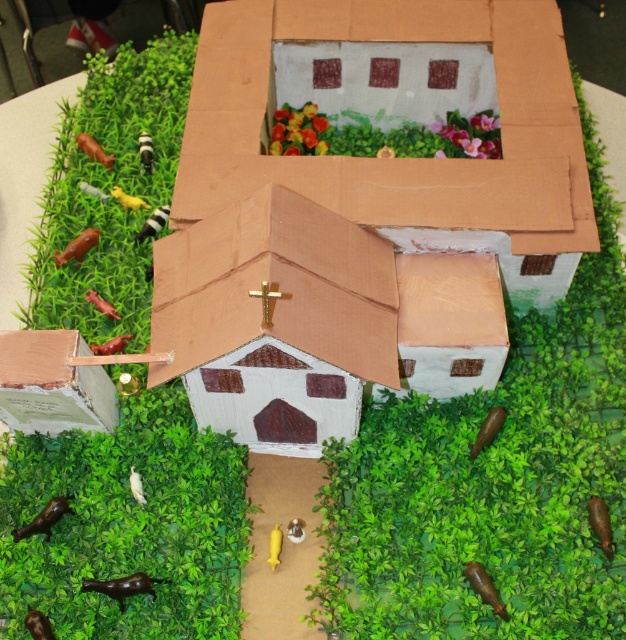
Consider the image. Is matte cardboard church at center shorter than brown matte cow at lower left?

In fact, matte cardboard church at center may be taller than brown matte cow at lower left.

Does matte cardboard church at center have a lesser width compared to brown matte cow at lower left?

Incorrect, matte cardboard church at center's width is not less than brown matte cow at lower left's.

The image size is (626, 640). I want to click on matte cardboard church at center, so click(x=387, y=157).

You are a GUI agent. You are given a task and a screenshot of the screen. Output one action in this format:
    pyautogui.click(x=<x>, y=<y>)
    Task: Click on the matte cardboard church at center
    The width and height of the screenshot is (626, 640).
    Given the screenshot: What is the action you would take?
    pos(387,157)

Who is lower down, matte cardboard church at center or brown matte horse at lower left?

brown matte horse at lower left is below.

Based on the photo, which is above, matte cardboard church at center or brown matte horse at lower left?

matte cardboard church at center is higher up.

Is point (284, 289) positioned behind point (126, 584)?

That is False.

Identify the location of matte cardboard church at center. (387, 157).

Does brown matte horse at lower left have a greater width compared to brown matte cow at lower left?

Yes, brown matte horse at lower left is wider than brown matte cow at lower left.

Is brown matte horse at lower left taller than brown matte cow at lower left?

No.

Does point (98, 584) lie in front of point (44, 518)?

Yes.

Image resolution: width=626 pixels, height=640 pixels. Find the location of `brown matte horse at lower left`. brown matte horse at lower left is located at coordinates (121, 586).